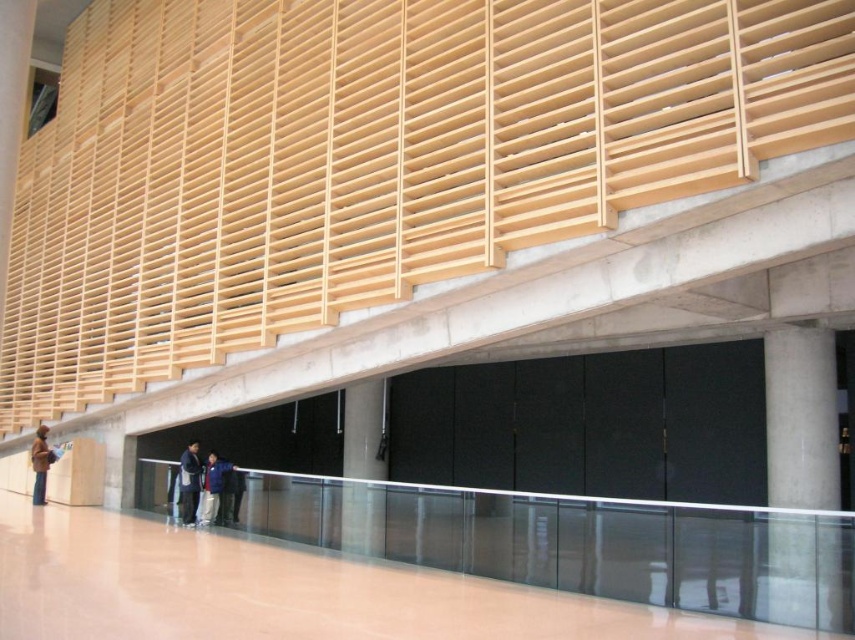
Question: Which object appears farthest from the camera in this image?

Choices:
 (A) clear glass balustrade at lower center
 (B) dark blue jacket at center

Answer: (B)

Question: Does dark blue jacket at center have a greater width compared to brown leather jacket at lower left?

Choices:
 (A) yes
 (B) no

Answer: (B)

Question: Does concrete column at center appear over blue fabric jacket at lower center?

Choices:
 (A) no
 (B) yes

Answer: (B)

Question: Among these points, which one is nearest to the camera?

Choices:
 (A) (40, 492)
 (B) (770, 576)

Answer: (B)

Question: Can you confirm if clear glass balustrade at lower center is positioned above dark blue jacket at center?

Choices:
 (A) no
 (B) yes

Answer: (A)

Question: Which point is closer to the camera taking this photo?

Choices:
 (A) (43, 496)
 (B) (193, 451)
 (C) (797, 380)

Answer: (C)